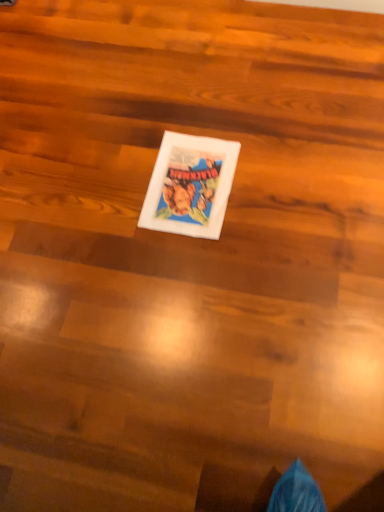
I want to click on vacant space to the right of white matte comic book at center, so click(278, 174).